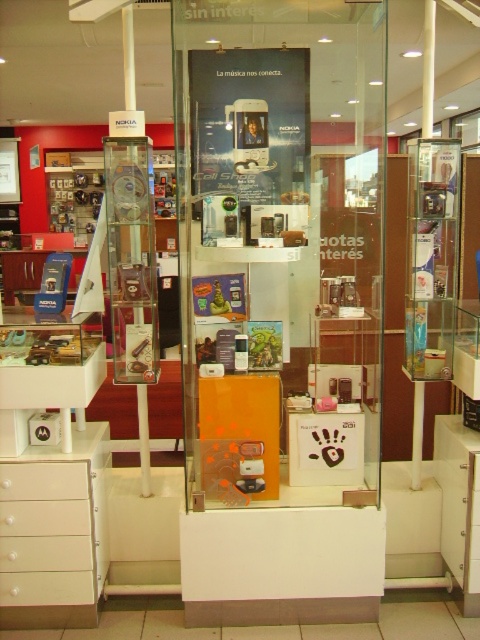
In the scene shown: You are a store employee who needs to place a new promotional poster that is 2 feet wide. The poster must be placed on either the transparent glass display case at center or the white matte drawer at lower left. Based on their sizes, which object can accommodate the poster without it overlapping the edges?

The transparent glass display case at center is bigger than the white matte drawer at lower left, so the poster can be placed on the transparent glass display case at center without overlapping the edges.

You are a customer in the store and want to reach both the transparent glass display case at center and the white matte drawer at lower left. Which one should you approach first to be closer to the entrance?

The white matte drawer at lower left is closer to the entrance because it is to the left of the transparent glass display case at center, which is further to the right.